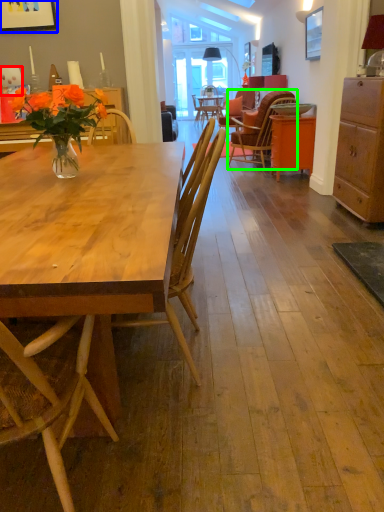
Question: Estimate the real-world distances between objects in this image. Which object is farther from coffee cup (highlighted by a red box), picture frame (highlighted by a blue box) or chair (highlighted by a green box)?

Choices:
 (A) picture frame
 (B) chair

Answer: (B)